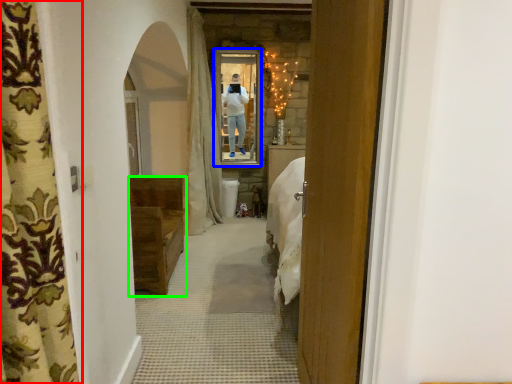
Question: Considering the real-world distances, which object is closest to curtain (highlighted by a red box)? mirror (highlighted by a blue box) or furniture (highlighted by a green box).

Choices:
 (A) mirror
 (B) furniture

Answer: (B)